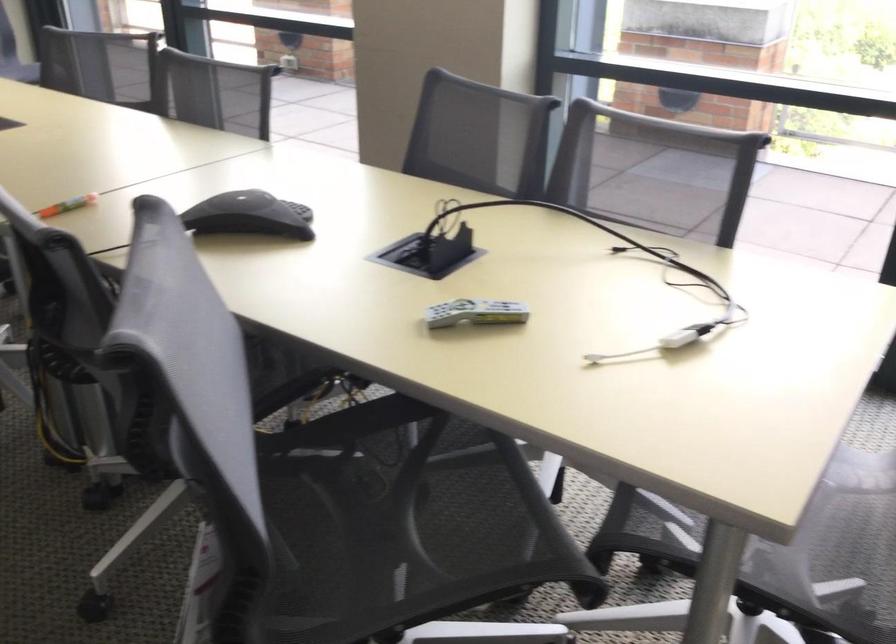
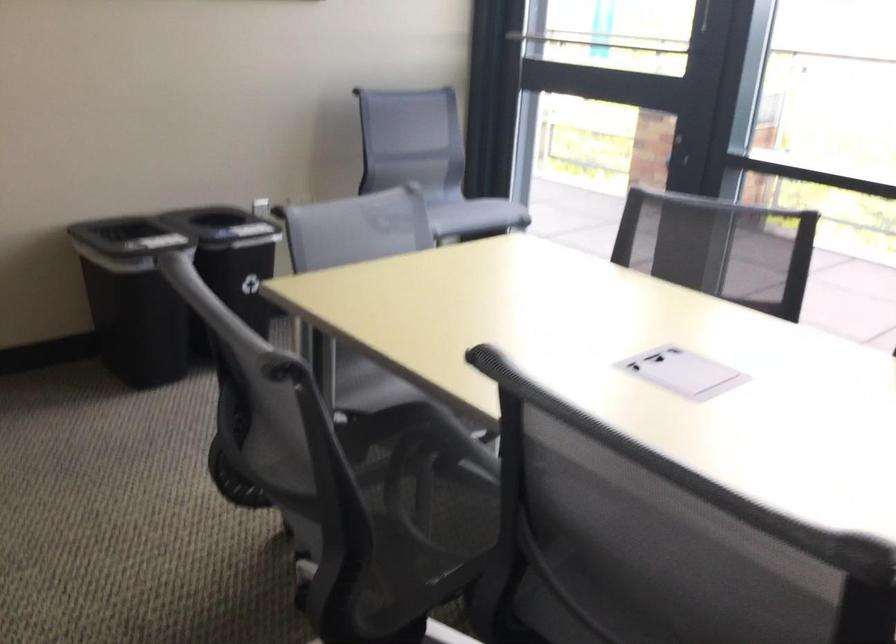
The images are taken continuously from a first-person perspective. In which direction are you moving?

The cameraman walked toward left, forward.